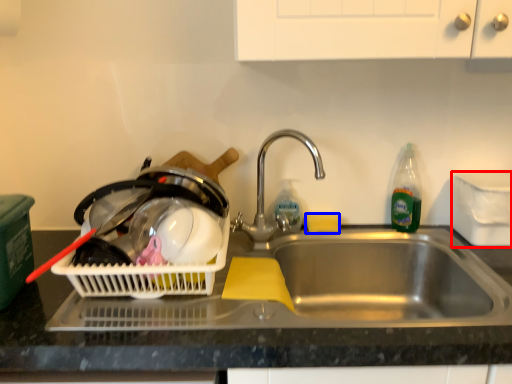
Question: Which of the following is the closest to the observer, appliance (highlighted by a red box) or food (highlighted by a blue box)?

Choices:
 (A) appliance
 (B) food

Answer: (A)